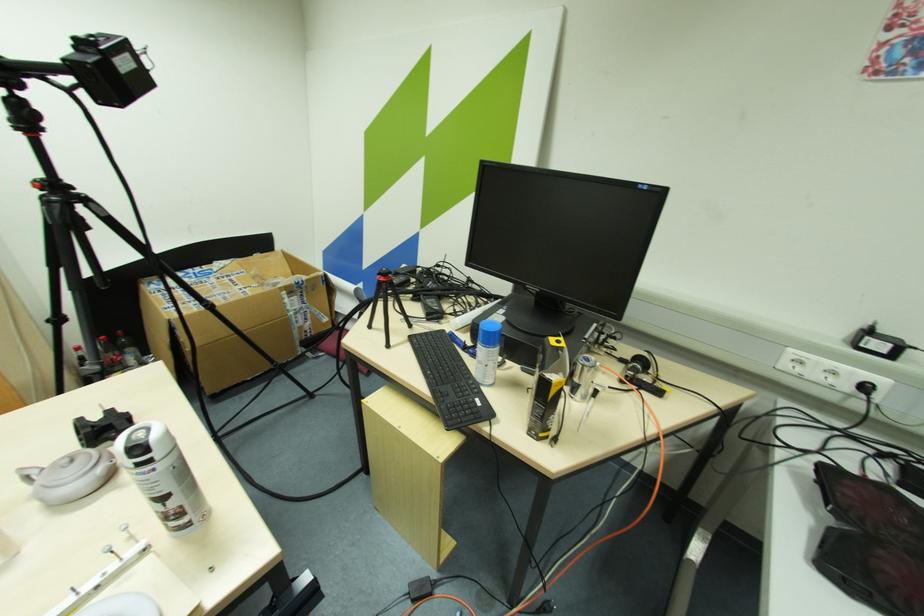
You are a GUI agent. You are given a task and a screenshot of the screen. Output one action in this format:
    pyautogui.click(x=<x>, y=<y>)
    Task: Click on the yellow utility tool
    
    Given the screenshot: What is the action you would take?
    pyautogui.click(x=550, y=387)